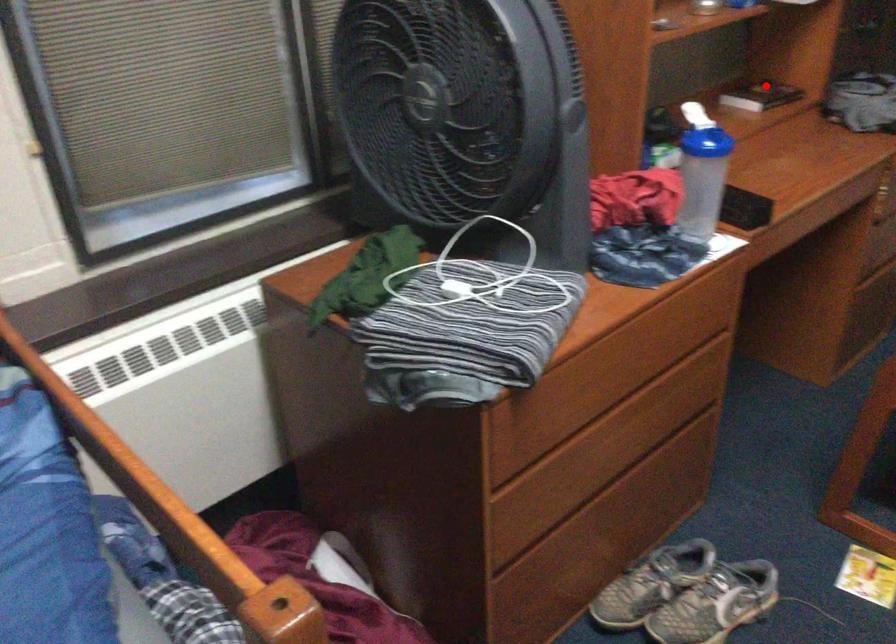
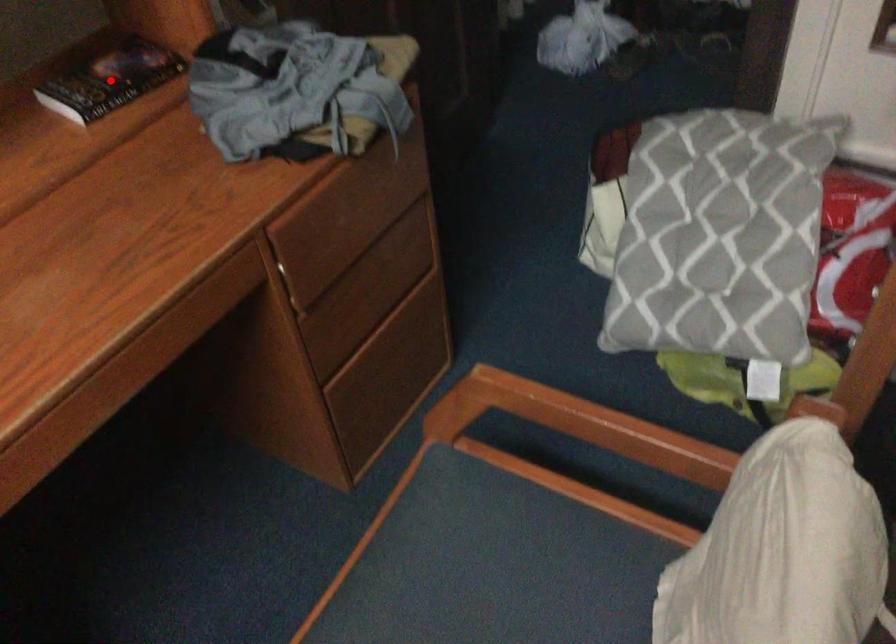
I am providing you with two images of the same scene from different viewpoints. A red point is marked on the first image and another point is marked on the second image. Is the marked point in image1 the same physical position as the marked point in image2?

Yes